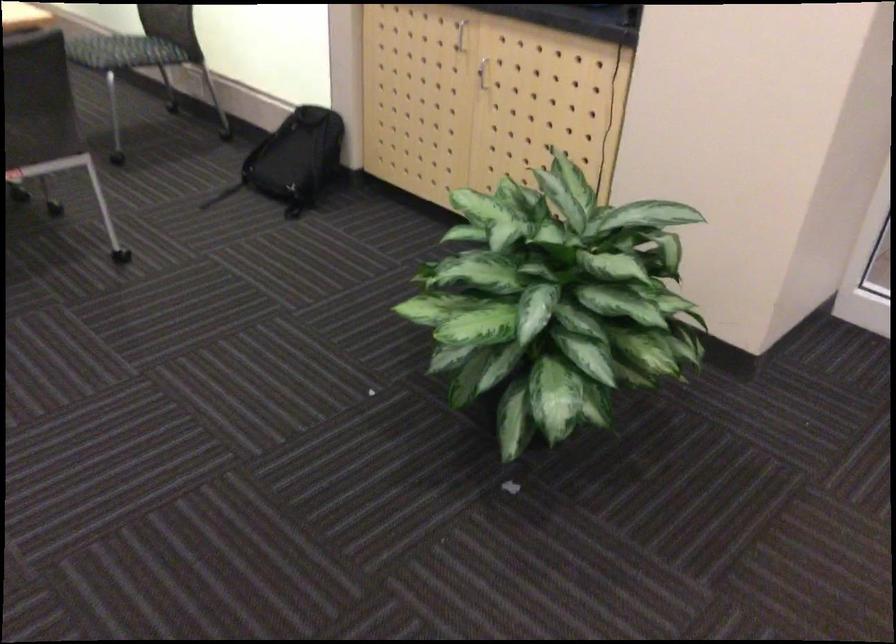
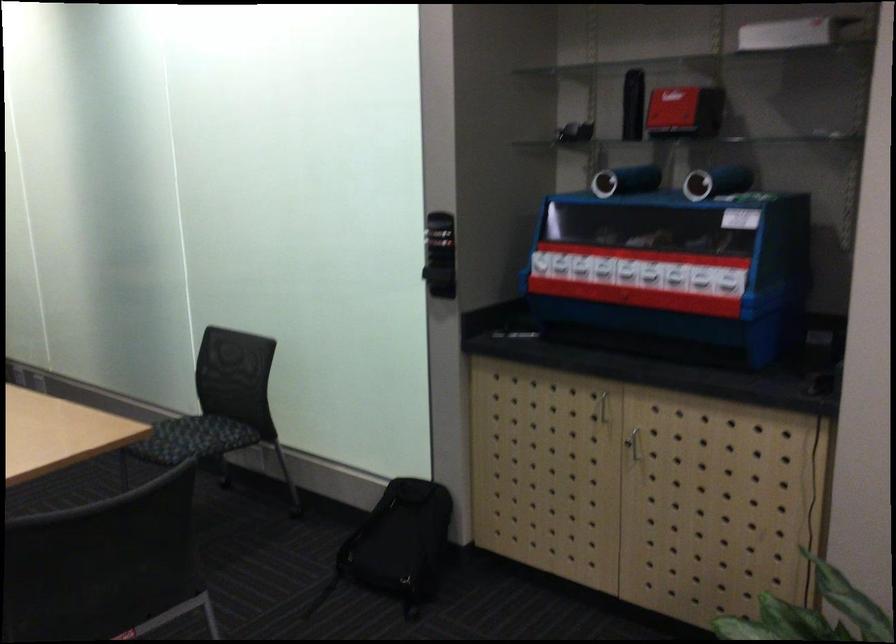
Where in the second image is the point corresponding to (470,71) from the first image?

(633, 442)